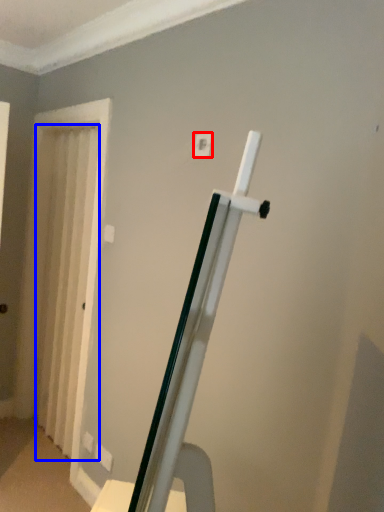
Question: Which point is closer to the camera, light switch (highlighted by a red box) or curtain (highlighted by a blue box)?

Choices:
 (A) light switch
 (B) curtain

Answer: (A)